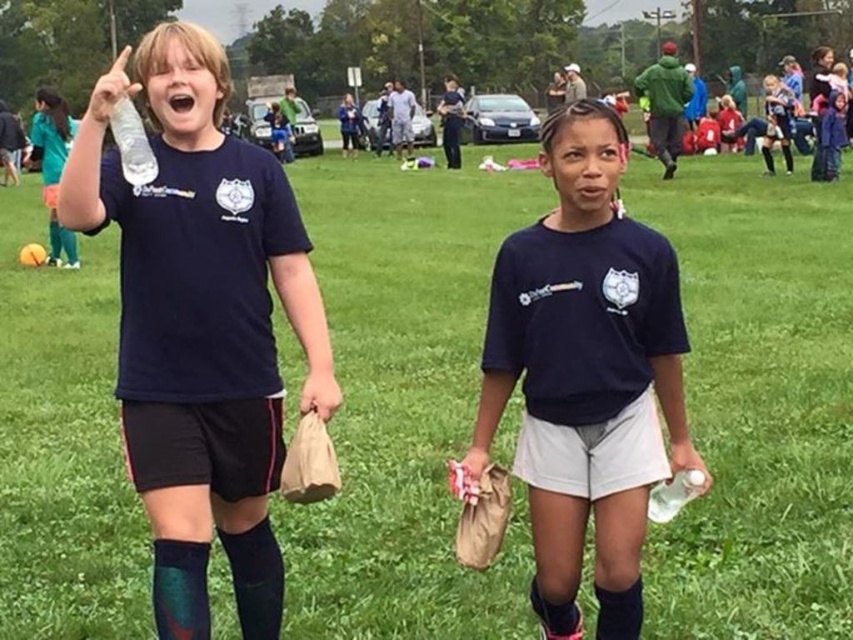
Who is lower down, clear plastic bottle at upper left or black knit sock at lower right?

Positioned lower is black knit sock at lower right.

Is clear plastic bottle at upper left thinner than black knit sock at lower right?

Correct, clear plastic bottle at upper left's width is less than black knit sock at lower right's.

Identify the location of clear plastic bottle at upper left. (132, 144).

Who is shorter, matte black water bottle at left or clear plastic bottle at lower right?

clear plastic bottle at lower right

Locate an element on the screen. matte black water bottle at left is located at coordinates (201, 324).

Is point (77, 138) in front of point (647, 513)?

That is True.

Locate an element on the screen. matte black water bottle at left is located at coordinates (201, 324).

Between point (611, 177) and point (666, 516), which one is positioned in front?

Point (611, 177) is more forward.

Is point (648, 408) less distant than point (656, 497)?

Yes.

Where is `matte black shirt at center`? matte black shirt at center is located at coordinates (583, 368).